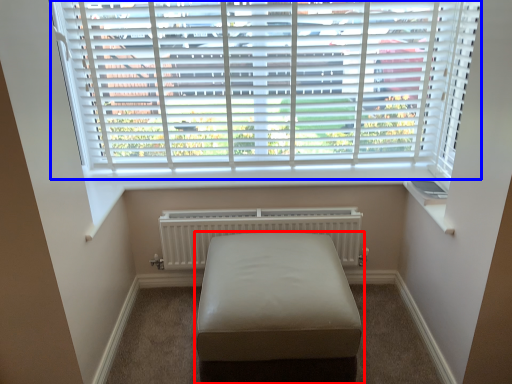
Question: Which object is further to the camera taking this photo, furniture (highlighted by a red box) or window blind (highlighted by a blue box)?

Choices:
 (A) furniture
 (B) window blind

Answer: (B)